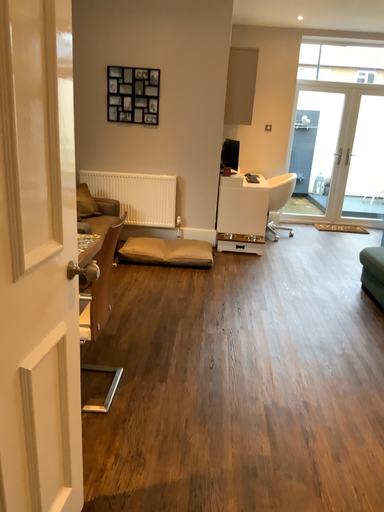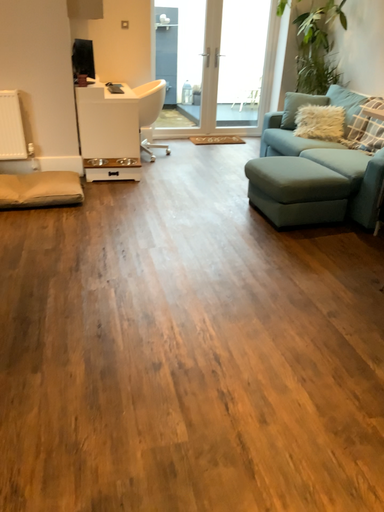
Question: Which way did the camera rotate in the video?

Choices:
 (A) rotated downward
 (B) rotated upward

Answer: (A)